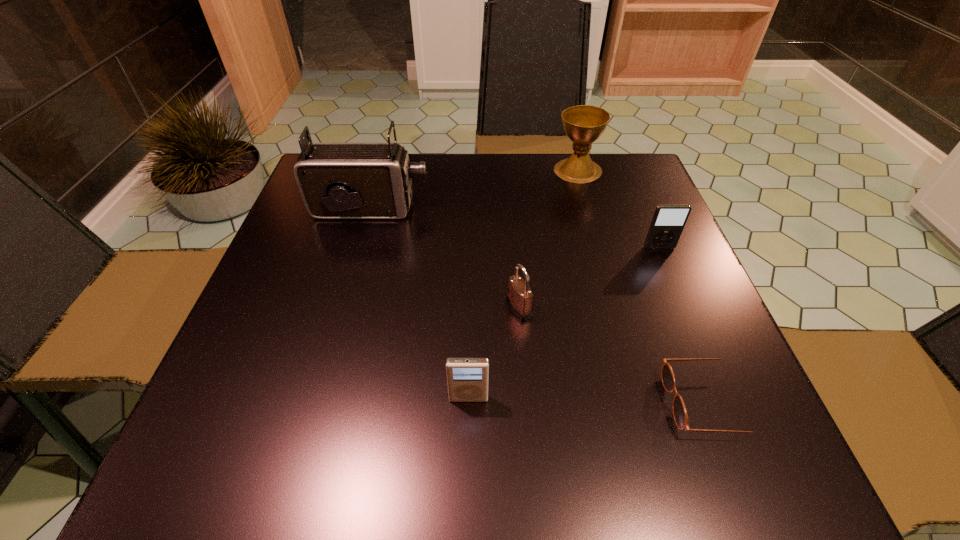
Locate an element on the screen. This screenshot has width=960, height=540. the shortest object is located at coordinates [680, 416].

You are a GUI agent. You are given a task and a screenshot of the screen. Output one action in this format:
    pyautogui.click(x=<x>, y=<y>)
    Task: Click on the vacant space positioned 0.060m at the lens of the second farthest object
    This screenshot has height=540, width=960.
    Given the screenshot: What is the action you would take?
    pyautogui.click(x=453, y=209)

Find the location of `free space located 0.170m on the front of the farthest object`. free space located 0.170m on the front of the farthest object is located at coordinates (593, 225).

Locate an element on the screen. blank space located on the front-facing side of the right iPod is located at coordinates (684, 309).

This screenshot has height=540, width=960. In order to click on free space located 0.280m on the left of the padlock in this screenshot , I will do 362,308.

I want to click on free space located on the front-facing side of the left iPod, so click(468, 446).

Where is `vacant space situated on the front-facing side of the shortest object`? Image resolution: width=960 pixels, height=540 pixels. vacant space situated on the front-facing side of the shortest object is located at coordinates (631, 402).

I want to click on vacant space located on the front-facing side of the shortest object, so click(458, 402).

The width and height of the screenshot is (960, 540). What are the coordinates of `free location located 0.080m on the front-facing side of the shortest object` in the screenshot? It's located at (618, 402).

Image resolution: width=960 pixels, height=540 pixels. Find the location of `camcorder that is at the far edge`. camcorder that is at the far edge is located at coordinates (336, 180).